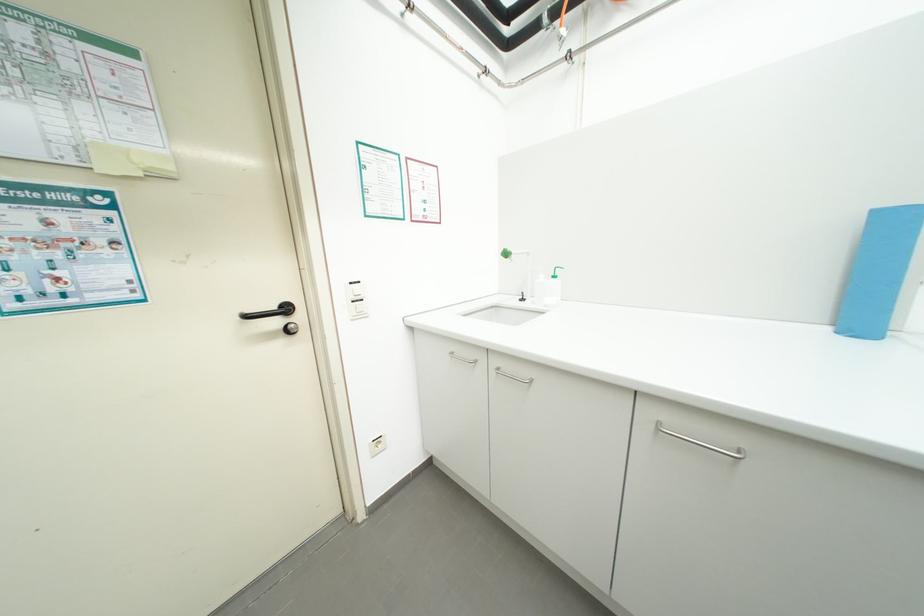
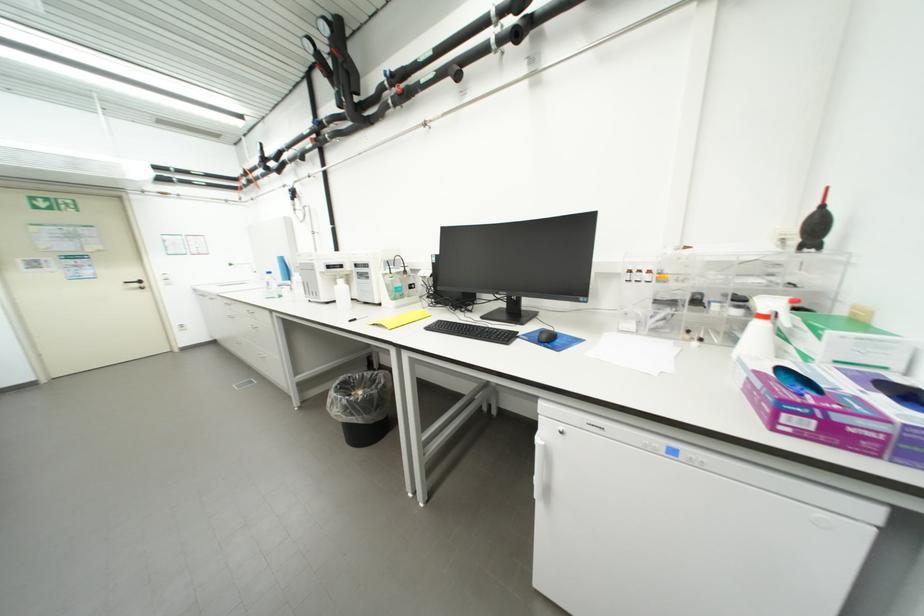
The point at (285, 323) is marked in the first image. Where is the corresponding point in the second image?

(144, 286)